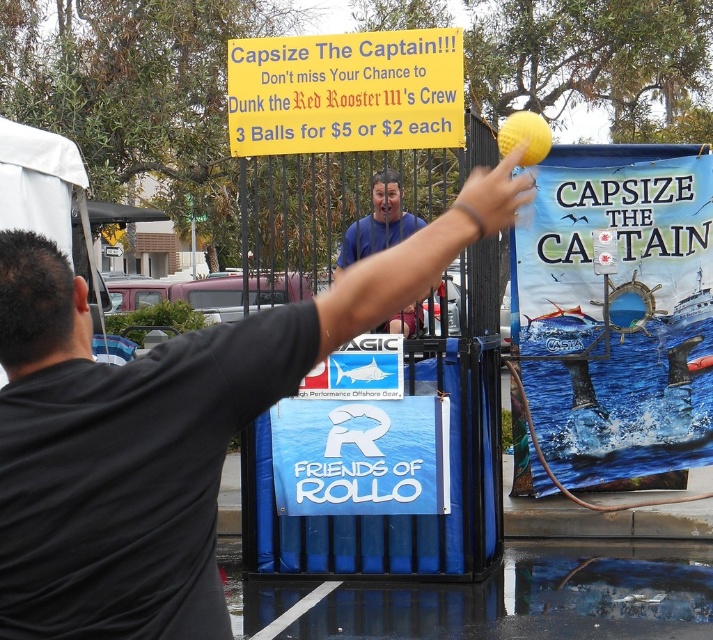
Question: From the image, what is the correct spatial relationship of yellow paper sign at upper center in relation to blue shirt at center?

Choices:
 (A) right
 (B) left

Answer: (B)

Question: Which object is farther from the camera taking this photo?

Choices:
 (A) black matte shirt at upper center
 (B) blue shirt at center

Answer: (B)

Question: Which of the following is the closest to the observer?

Choices:
 (A) yellow paper sign at upper center
 (B) black matte shirt at upper center
 (C) blue shirt at center

Answer: (B)

Question: Which point appears closest to the camera in this image?

Choices:
 (A) (46, 476)
 (B) (401, 212)

Answer: (A)

Question: Is black matte shirt at upper center smaller than yellow paper sign at upper center?

Choices:
 (A) yes
 (B) no

Answer: (B)

Question: Is black matte shirt at upper center to the right of yellow paper sign at upper center from the viewer's perspective?

Choices:
 (A) yes
 (B) no

Answer: (A)